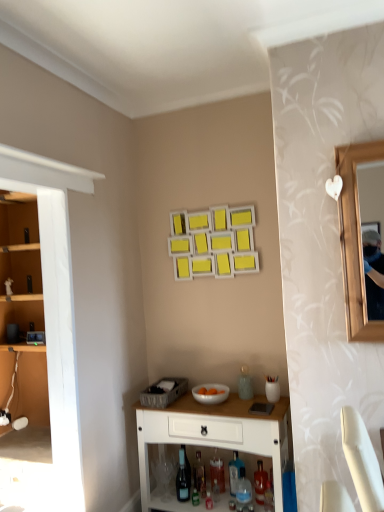
This screenshot has width=384, height=512. I want to click on blank space situated above white glossy bowl at lower center (from a real-world perspective), so click(208, 390).